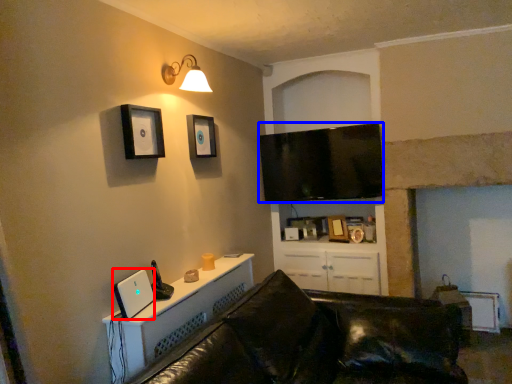
Question: Which point is further to the camera, desktop computer (highlighted by a red box) or television (highlighted by a blue box)?

Choices:
 (A) desktop computer
 (B) television

Answer: (B)